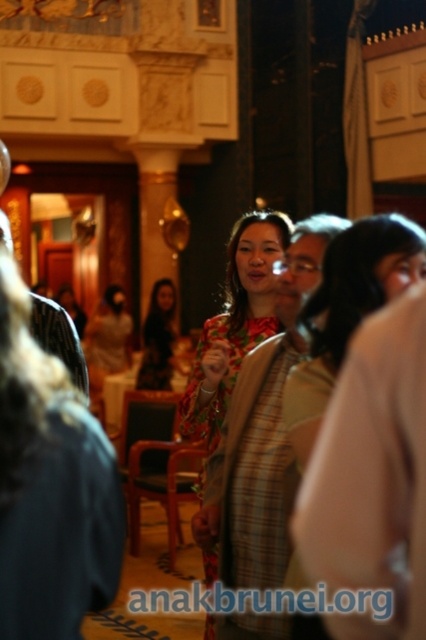
Question: Among these points, which one is nearest to the camera?

Choices:
 (A) coord(279,468)
 (B) coord(367,276)
 (C) coord(169,330)

Answer: (B)

Question: Which of the following is the closest to the observer?

Choices:
 (A) (244, 465)
 (B) (371, 227)
 (C) (158, 323)

Answer: (B)

Question: Does plaid fabric shirt at center have a lesser width compared to matte floral dress at center?

Choices:
 (A) no
 (B) yes

Answer: (B)

Question: Does plaid fabric shirt at center have a larger size compared to floral dress at center?

Choices:
 (A) no
 (B) yes

Answer: (A)

Question: Which object is farther from the camera taking this photo?

Choices:
 (A) floral dress at center
 (B) matte floral dress at center

Answer: (B)

Question: Observing the image, what is the correct spatial positioning of floral dress at center in reference to matte floral dress at center?

Choices:
 (A) left
 (B) right

Answer: (B)